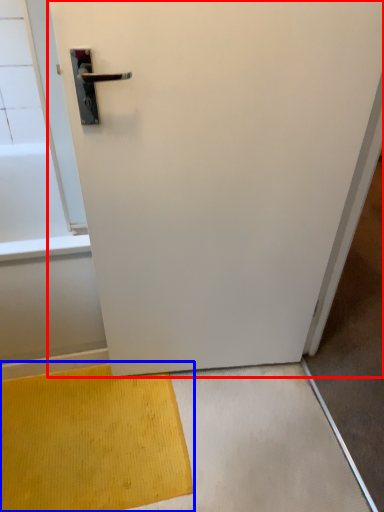
Question: Which of the following is the closest to the observer, door (highlighted by a red box) or doormat (highlighted by a blue box)?

Choices:
 (A) door
 (B) doormat

Answer: (A)